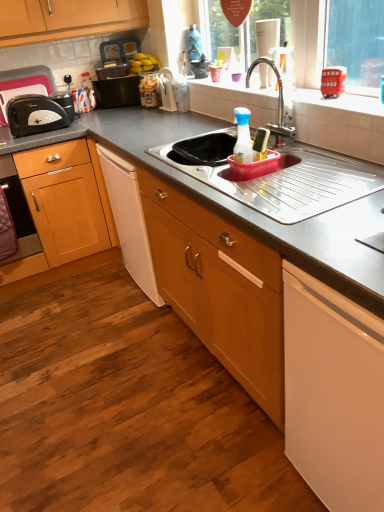
Question: Does black plastic toaster at left, placed as the 2th appliance when sorted from right to left, have a smaller size compared to white plastic dish rack at upper center, which appears as the second appliance when viewed from the left?

Choices:
 (A) no
 (B) yes

Answer: (A)

Question: Is black plastic toaster at left, placed as the 2th appliance when sorted from right to left, to the left of white plastic dish rack at upper center, which appears as the second appliance when viewed from the left, from the viewer's perspective?

Choices:
 (A) yes
 (B) no

Answer: (A)

Question: Is black plastic toaster at left, which ranks as the 1th appliance in left-to-right order, positioned far away from white plastic dish rack at upper center, marked as the first appliance in a right-to-left arrangement?

Choices:
 (A) no
 (B) yes

Answer: (A)

Question: Would you say black plastic toaster at left, placed as the 2th appliance when sorted from right to left, contains white plastic dish rack at upper center, which appears as the second appliance when viewed from the left?

Choices:
 (A) no
 (B) yes

Answer: (A)

Question: Does black plastic toaster at left, which ranks as the 1th appliance in left-to-right order, have a lesser height compared to white plastic dish rack at upper center, which appears as the second appliance when viewed from the left?

Choices:
 (A) yes
 (B) no

Answer: (B)

Question: In terms of size, does stainless steel sink at center appear bigger or smaller than matte black toaster at left?

Choices:
 (A) big
 (B) small

Answer: (A)

Question: From the image's perspective, relative to matte black toaster at left, is stainless steel sink at center above or below?

Choices:
 (A) below
 (B) above

Answer: (A)

Question: Would you say stainless steel sink at center is to the left or to the right of matte black toaster at left in the picture?

Choices:
 (A) left
 (B) right

Answer: (B)

Question: Is point (301, 195) positioned closer to the camera than point (18, 124)?

Choices:
 (A) farther
 (B) closer

Answer: (B)

Question: Which is correct: silver metallic faucet at upper center is inside yellow matte bananas at upper center, or outside of it?

Choices:
 (A) inside
 (B) outside

Answer: (B)

Question: In terms of size, does silver metallic faucet at upper center appear bigger or smaller than yellow matte bananas at upper center?

Choices:
 (A) small
 (B) big

Answer: (B)

Question: In terms of width, does silver metallic faucet at upper center look wider or thinner when compared to yellow matte bananas at upper center?

Choices:
 (A) thin
 (B) wide

Answer: (A)

Question: Is point (292, 134) positioned closer to the camera than point (142, 68)?

Choices:
 (A) closer
 (B) farther

Answer: (A)

Question: Based on their sizes in the image, would you say yellow matte bananas at upper center is bigger or smaller than white ceramic window sill at upper center?

Choices:
 (A) big
 (B) small

Answer: (A)

Question: Considering the positions of yellow matte bananas at upper center and white ceramic window sill at upper center in the image, is yellow matte bananas at upper center taller or shorter than white ceramic window sill at upper center?

Choices:
 (A) short
 (B) tall

Answer: (B)